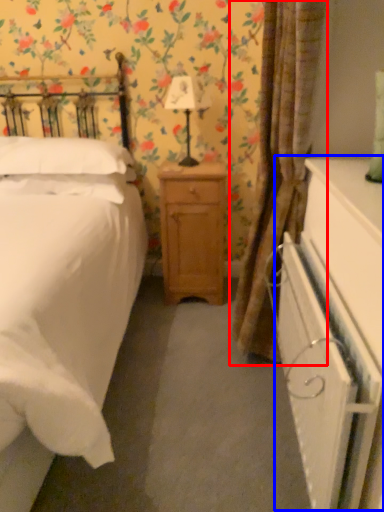
Question: Among these objects, which one is farthest to the camera, curtain (highlighted by a red box) or dresser (highlighted by a blue box)?

Choices:
 (A) curtain
 (B) dresser

Answer: (A)